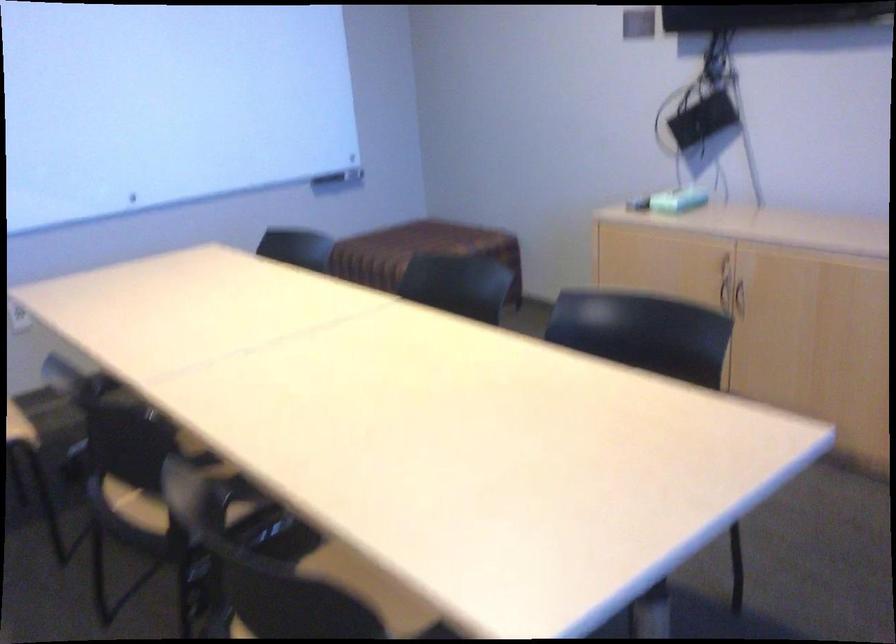
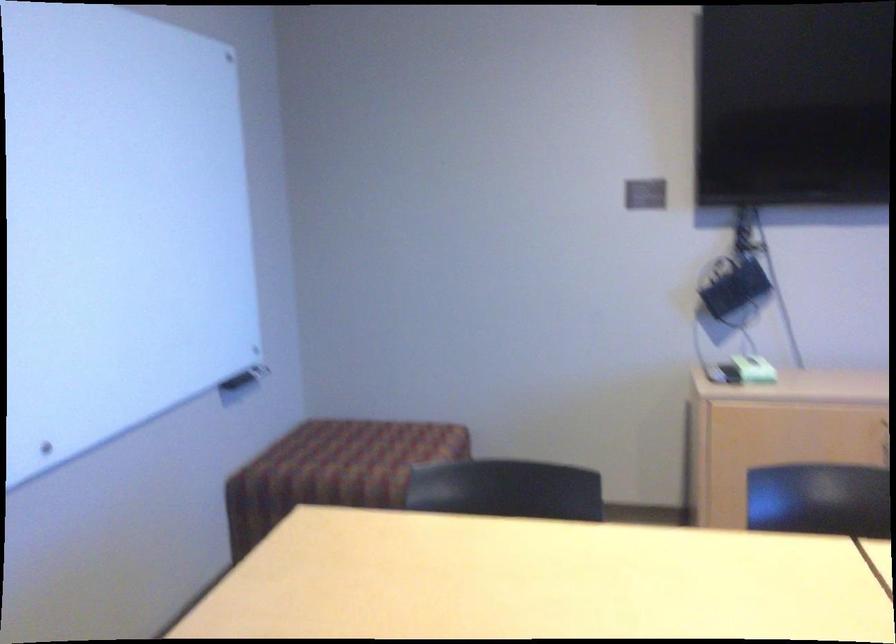
In the second image, find the point that corresponds to [670,196] in the first image.

(754, 368)